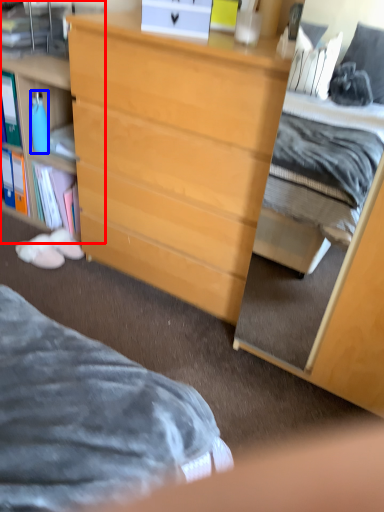
Question: Among these objects, which one is nearest to the camera, cabinetry (highlighted by a red box) or bottle (highlighted by a blue box)?

Choices:
 (A) cabinetry
 (B) bottle

Answer: (A)